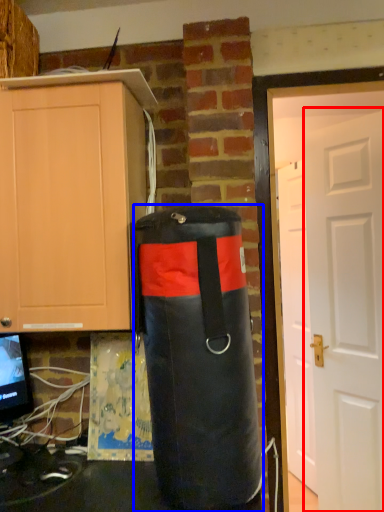
Question: Which object is further to the camera taking this photo, door (highlighted by a red box) or punching bag (highlighted by a blue box)?

Choices:
 (A) door
 (B) punching bag

Answer: (A)